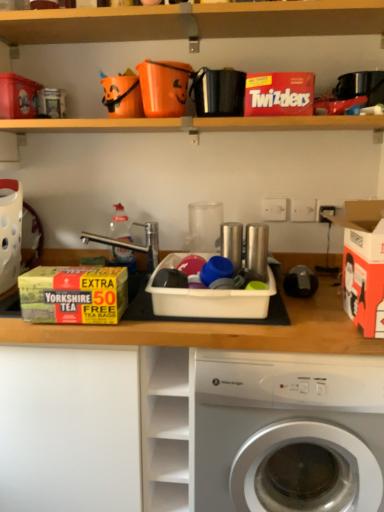
Question: Which direction should I rotate to face black leather wallet at upper center, arranged as the 2th appliance when ordered from the bottom, — up or down?

Choices:
 (A) up
 (B) down

Answer: (A)

Question: From the image's perspective, does red cardboard twizzlers at upper center, the 2th storage box positioned from the right, appear lower than yellow cardboard box at left, which ranks as the fourth storage box in right-to-left order?

Choices:
 (A) no
 (B) yes

Answer: (A)

Question: Is red cardboard twizzlers at upper center, the 2th storage box positioned from the right, touching yellow cardboard box at left, which ranks as the fourth storage box in right-to-left order?

Choices:
 (A) yes
 (B) no

Answer: (B)

Question: Is red cardboard twizzlers at upper center, the 2th storage box positioned from the right, oriented away from yellow cardboard box at left, which ranks as the fourth storage box in right-to-left order?

Choices:
 (A) no
 (B) yes

Answer: (A)

Question: Is yellow cardboard box at left, the second storage box when ordered from left to right, completely or partially inside red cardboard twizzlers at upper center, acting as the 4th storage box starting from the left?

Choices:
 (A) yes
 (B) no

Answer: (B)

Question: From a real-world perspective, is red cardboard twizzlers at upper center, the 2th storage box positioned from the right, over yellow cardboard box at left, the second storage box when ordered from left to right?

Choices:
 (A) yes
 (B) no

Answer: (A)

Question: Does red cardboard twizzlers at upper center, acting as the 4th storage box starting from the left, appear on the right side of yellow cardboard box at left, which ranks as the fourth storage box in right-to-left order?

Choices:
 (A) no
 (B) yes

Answer: (B)

Question: Is yellow cardboard box at left, which ranks as the fourth storage box in right-to-left order, bigger than white glossy washing machine at lower center?

Choices:
 (A) yes
 (B) no

Answer: (B)

Question: Would you consider yellow cardboard box at left, the second storage box when ordered from left to right, to be distant from white glossy washing machine at lower center?

Choices:
 (A) no
 (B) yes

Answer: (A)

Question: Is yellow cardboard box at left, the second storage box when ordered from left to right, in contact with white glossy washing machine at lower center?

Choices:
 (A) no
 (B) yes

Answer: (A)

Question: Does yellow cardboard box at left, which ranks as the fourth storage box in right-to-left order, have a greater height compared to white glossy washing machine at lower center?

Choices:
 (A) yes
 (B) no

Answer: (B)

Question: From the image's perspective, is yellow cardboard box at left, the second storage box when ordered from left to right, on top of white glossy washing machine at lower center?

Choices:
 (A) no
 (B) yes

Answer: (B)

Question: Is yellow cardboard box at left, the second storage box when ordered from left to right, wider than white glossy washing machine at lower center?

Choices:
 (A) no
 (B) yes

Answer: (A)

Question: From a real-world perspective, is red cardboard twizzlers at upper center, the 2th storage box positioned from the right, positioned under black leather wallet at upper center, marked as the 1th appliance in a top-to-bottom arrangement, based on gravity?

Choices:
 (A) yes
 (B) no

Answer: (A)